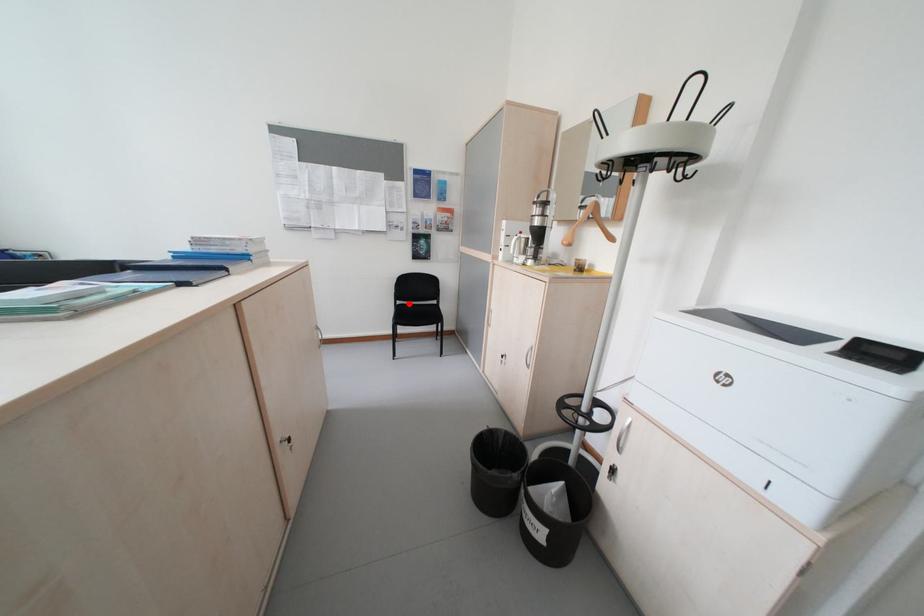
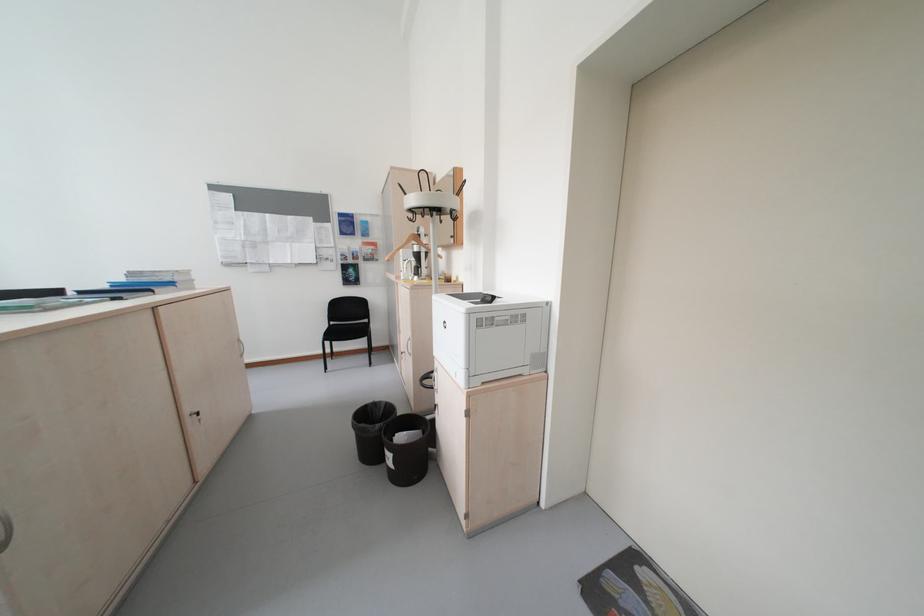
Locate, in the second image, the point that corresponds to the highlighted location in the first image.

(343, 323)